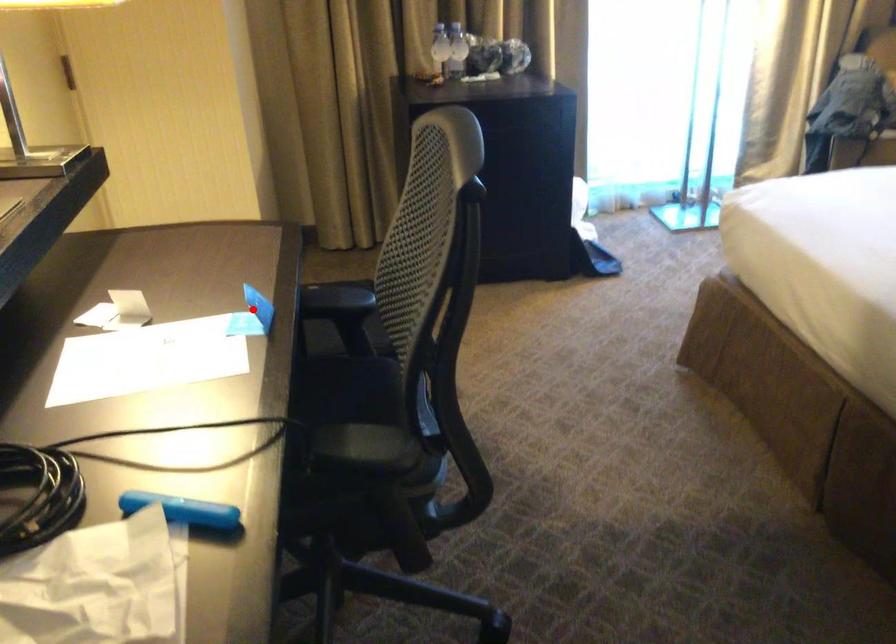
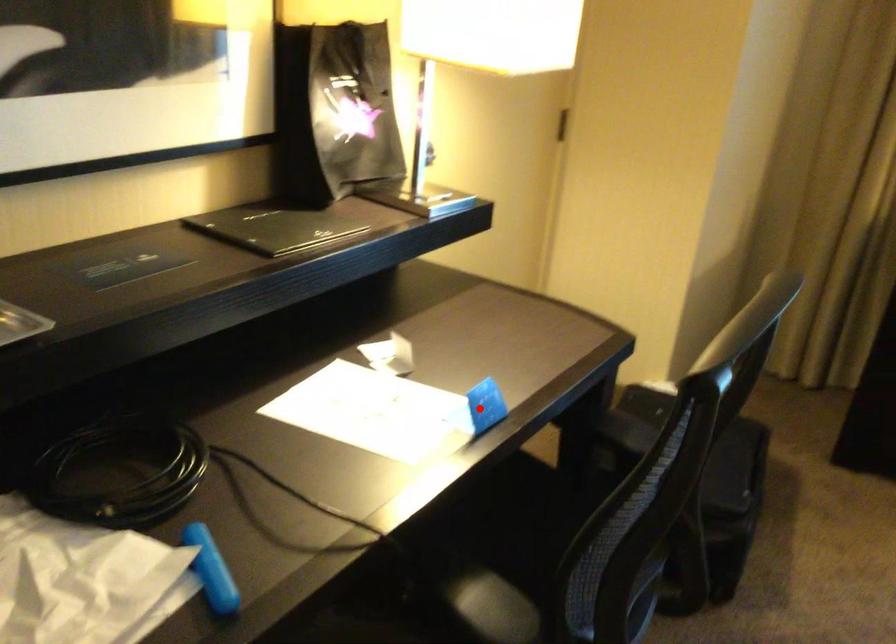
I am providing you with two images of the same scene from different viewpoints. A red point is marked on the first image and another point is marked on the second image. Do the highlighted points in image1 and image2 indicate the same real-world spot?

Yes